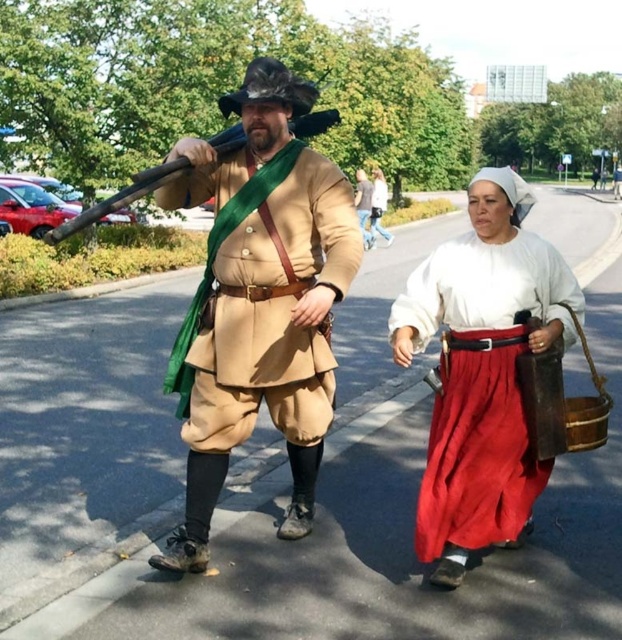
Is matte white blouse at center smaller than white linen dress at center?

Yes.

Is matte white blouse at center thinner than white linen dress at center?

In fact, matte white blouse at center might be wider than white linen dress at center.

Where is `matte white blouse at center`? The width and height of the screenshot is (622, 640). matte white blouse at center is located at coordinates (483, 371).

Is matte white blouse at center further to camera compared to matte brown leather purse at center?

No, matte white blouse at center is closer to the viewer.

Is matte white blouse at center positioned in front of matte brown leather purse at center?

Yes, matte white blouse at center is in front of matte brown leather purse at center.

Is point (513, 385) behind point (369, 202)?

That is False.

Image resolution: width=622 pixels, height=640 pixels. I want to click on matte white blouse at center, so click(x=483, y=371).

Does white linen dress at center appear on the left side of matte brown leather purse at center?

Correct, you'll find white linen dress at center to the left of matte brown leather purse at center.

Based on the photo, is white linen dress at center positioned behind matte brown leather purse at center?

No, it is in front of matte brown leather purse at center.

This screenshot has width=622, height=640. What do you see at coordinates (371, 204) in the screenshot?
I see `white linen dress at center` at bounding box center [371, 204].

You are a GUI agent. You are given a task and a screenshot of the screen. Output one action in this format:
    pyautogui.click(x=<x>, y=<y>)
    Task: Click on the white linen dress at center
    This screenshot has height=640, width=622.
    Given the screenshot: What is the action you would take?
    (x=371, y=204)